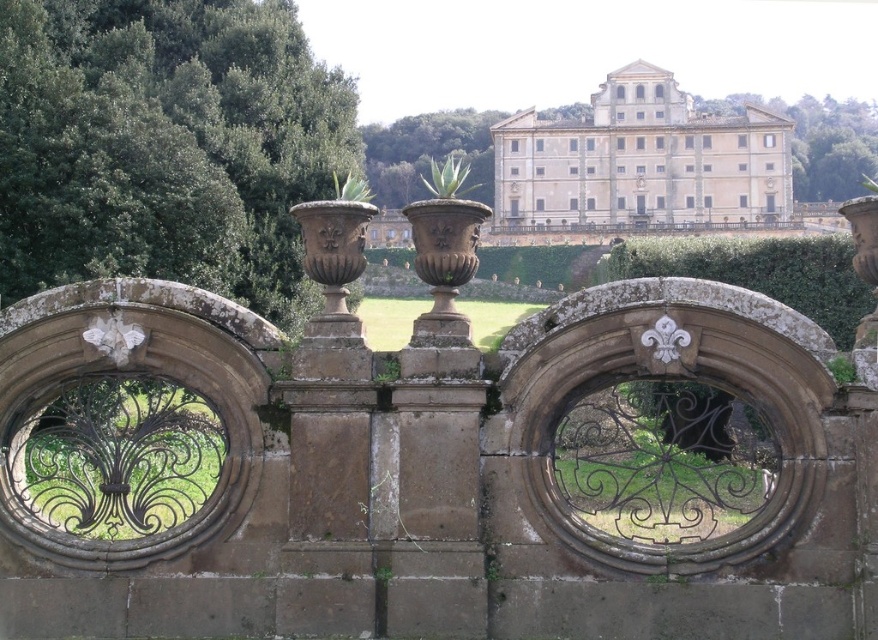
Between white stone building at center and green leafy tree at upper center, which one has less height?

green leafy tree at upper center is shorter.

Is point (686, 115) less distant than point (746, 93)?

Yes, it is in front of point (746, 93).

Who is more forward, (631, 96) or (799, 179)?

Point (631, 96) is in front.

You are a GUI agent. You are given a task and a screenshot of the screen. Output one action in this format:
    pyautogui.click(x=<x>, y=<y>)
    Task: Click on the white stone building at center
    The height and width of the screenshot is (640, 878).
    Given the screenshot: What is the action you would take?
    pyautogui.click(x=641, y=161)

Is white stone building at center positioned at the back of green leafy tree at center?

Yes, it is behind green leafy tree at center.

Does white stone building at center appear on the right side of green leafy tree at center?

Yes, white stone building at center is to the right of green leafy tree at center.

Describe the element at coordinates (641, 161) in the screenshot. The image size is (878, 640). I see `white stone building at center` at that location.

This screenshot has height=640, width=878. I want to click on white stone building at center, so click(x=641, y=161).

Who is taller, white stone building at center or green stone hedge at center?

white stone building at center is taller.

The height and width of the screenshot is (640, 878). I want to click on white stone building at center, so click(x=641, y=161).